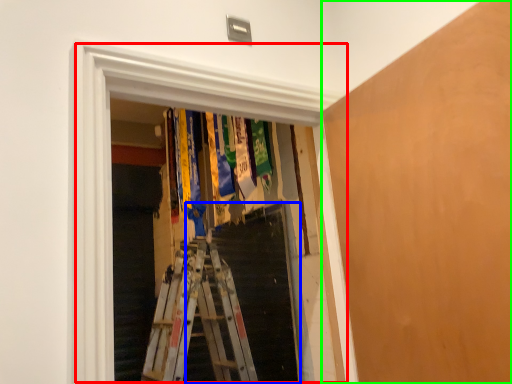
Question: Which object is positioned closest to window (highlighted by a red box)? Select from stairs (highlighted by a blue box) and plywood (highlighted by a green box).

Choices:
 (A) stairs
 (B) plywood

Answer: (B)